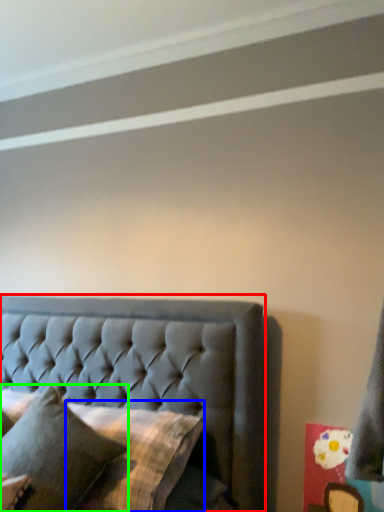
Question: Estimate the real-world distances between objects in this image. Which object is closer to bed (highlighted by a red box), pillow (highlighted by a blue box) or pillow (highlighted by a green box)?

Choices:
 (A) pillow
 (B) pillow

Answer: (A)